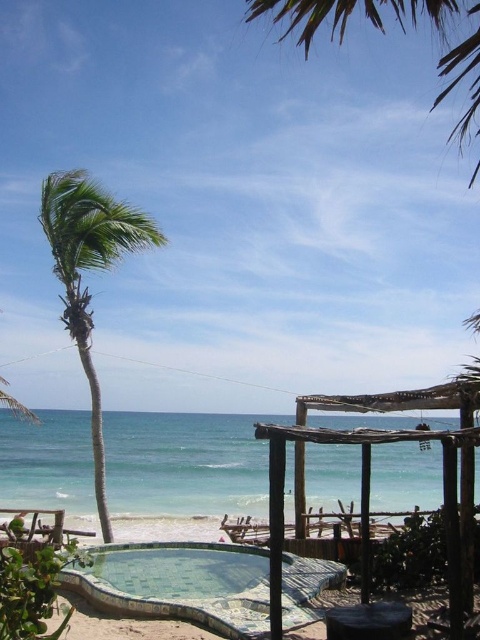
You are planning to install a new pergola in your backyard. You have a wooden pergola at center that you want to compare with the green leafy palm tree at upper center. Which structure is larger in size?

The wooden pergola at center is smaller than the green leafy palm tree at upper center, so the green leafy palm tree at upper center is larger in size.

You are a photographer setting up a shot of the wooden pergola at center and the green leafy palm tree at upper center. Which object should you adjust your camera angle to focus on first if you want to capture both in the same frame without moving the camera?

You should focus on the wooden pergola at center first because the green leafy palm tree at upper center is behind it, so adjusting the angle to ensure the pergola is centered will naturally include the palm tree in the background.

You are standing at the beach and want to walk from the rustic wooden structure with a thatched roof on the right to the palm tree on the left. There are two points marked on the path you might take. One is at coordinates point [197,570] and the other is at point [466,113]. Which point should you step on first if you want to follow the shortest path towards the palm tree?

You should step on point [197,570] first because it is in front of point [466,113] along your path towards the palm tree.